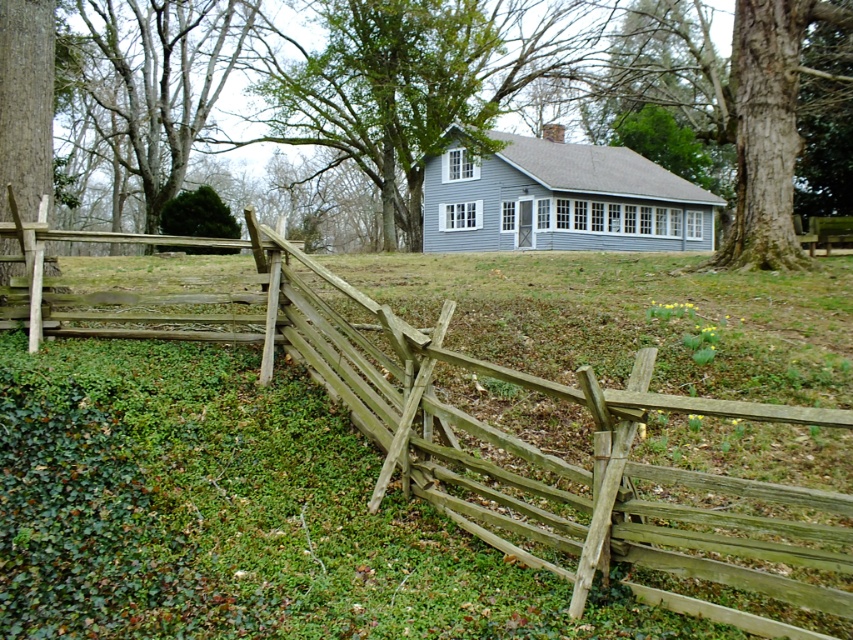
Question: In this image, where is smooth gray bark tree at upper left located relative to smooth brown tree trunk at left?

Choices:
 (A) below
 (B) above

Answer: (B)

Question: Is weathered wood fence at center below smooth brown tree trunk at left?

Choices:
 (A) yes
 (B) no

Answer: (A)

Question: Does weathered wood fence at center have a smaller size compared to smooth brown tree trunk at left?

Choices:
 (A) yes
 (B) no

Answer: (A)

Question: Which object appears closest to the camera in this image?

Choices:
 (A) smooth gray bark tree at upper left
 (B) smooth brown tree trunk at left

Answer: (B)

Question: Which point is farther to the camera?

Choices:
 (A) smooth brown tree trunk at left
 (B) weathered wood fence at center

Answer: (A)

Question: Which point is closer to the camera?

Choices:
 (A) weathered wood fence at center
 (B) smooth gray bark tree at upper left

Answer: (A)